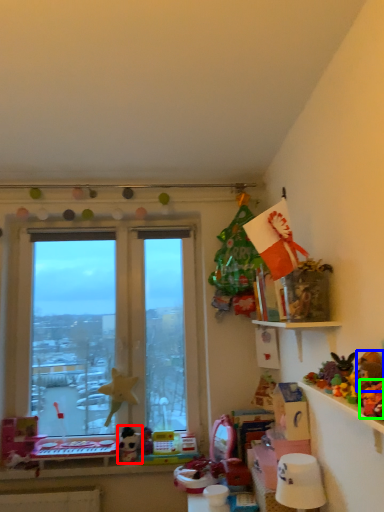
Question: Considering the real-world distances, which object is closest to toy (highlighted by a red box)? toy (highlighted by a blue box) or toy (highlighted by a green box).

Choices:
 (A) toy
 (B) toy

Answer: (A)